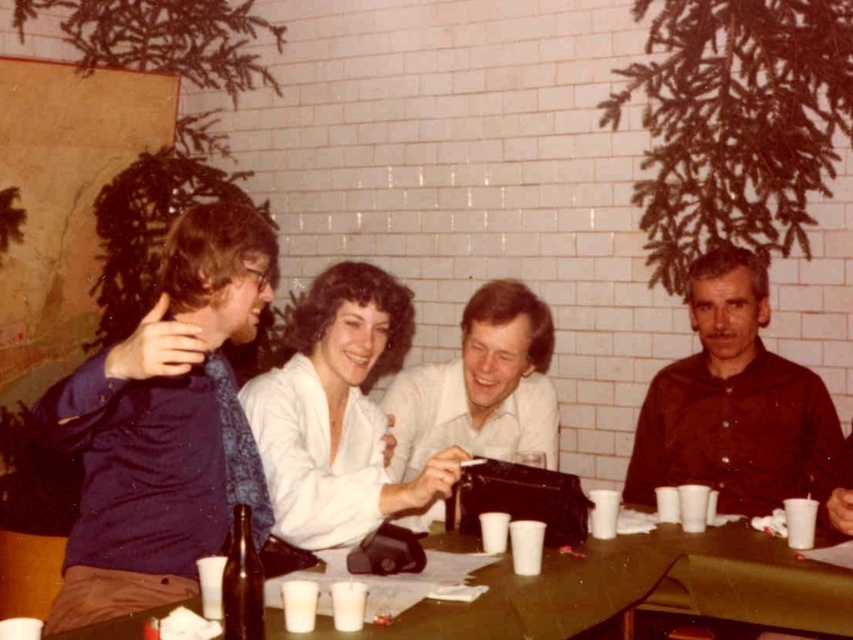
Question: Is white glossy shirt at center closer to the viewer compared to brown glass bottle at lower left?

Choices:
 (A) yes
 (B) no

Answer: (B)

Question: Which point appears farthest from the camera in this image?

Choices:
 (A) (474, 372)
 (B) (273, 369)
 (C) (746, 269)
 (D) (239, 497)

Answer: (C)

Question: Can you confirm if blue satin shirt at left is thinner than white satin blouse at center?

Choices:
 (A) no
 (B) yes

Answer: (B)

Question: Which point is closer to the camera taking this photo?

Choices:
 (A) (93, 589)
 (B) (532, 392)
 (C) (363, 301)

Answer: (A)

Question: Can you confirm if blue satin shirt at left is positioned to the right of dark brown shirt at right?

Choices:
 (A) yes
 (B) no

Answer: (B)

Question: Estimate the real-world distances between objects in this image. Which object is closer to the green plastic table at center?

Choices:
 (A) dark brown shirt at right
 (B) white glossy shirt at center
 (C) blue satin shirt at left

Answer: (C)